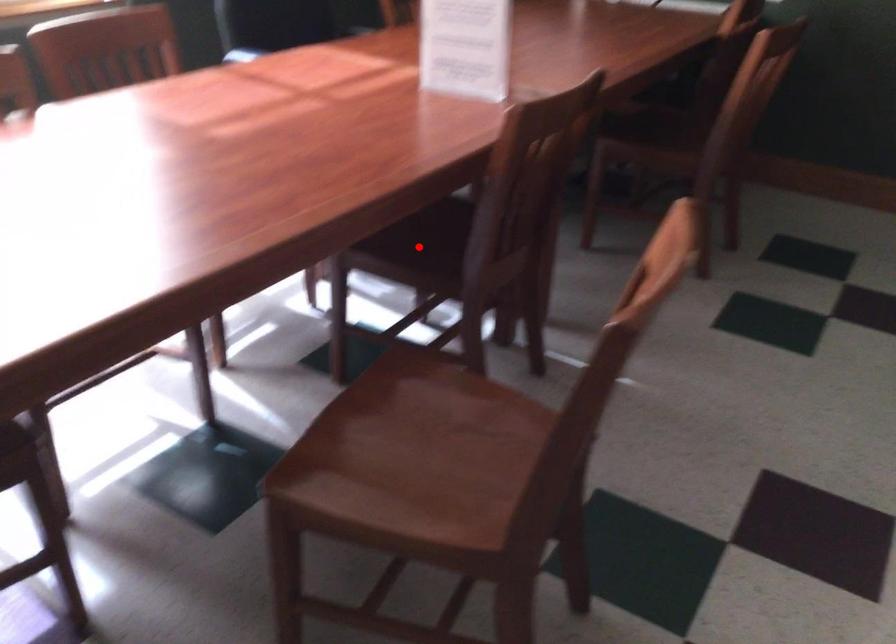
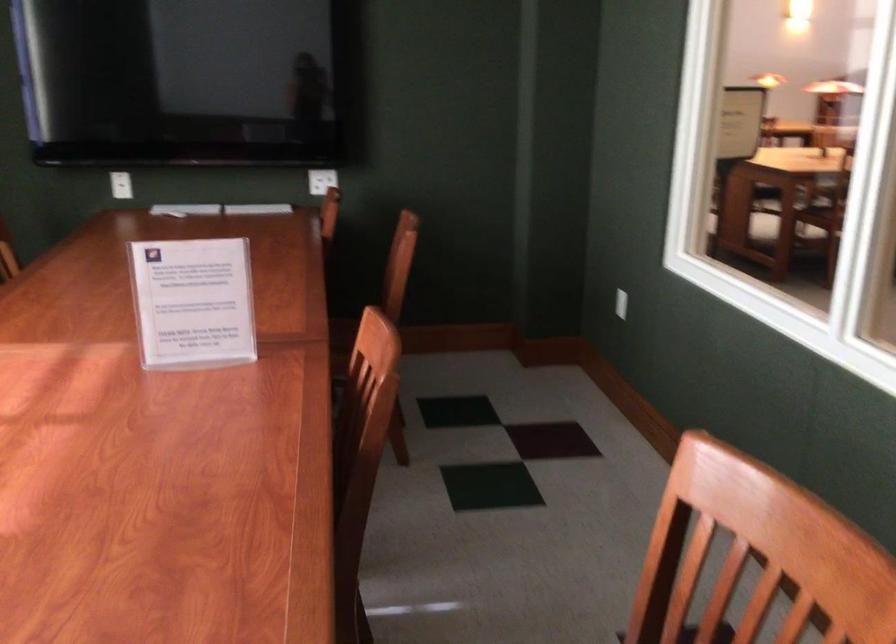
Question: I am providing you with two images of the same scene from different viewpoints. A red point is marked on the first image. Can you still see the location of the red point in image 2?

Choices:
 (A) Yes
 (B) No

Answer: (B)